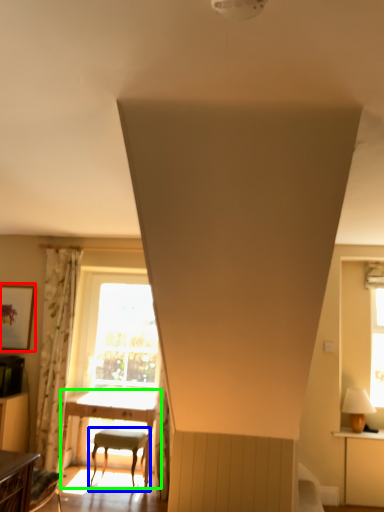
Question: Estimate the real-world distances between objects in this image. Which object is farther from picture frame (highlighted by a red box), chair (highlighted by a blue box) or table (highlighted by a green box)?

Choices:
 (A) chair
 (B) table

Answer: (A)